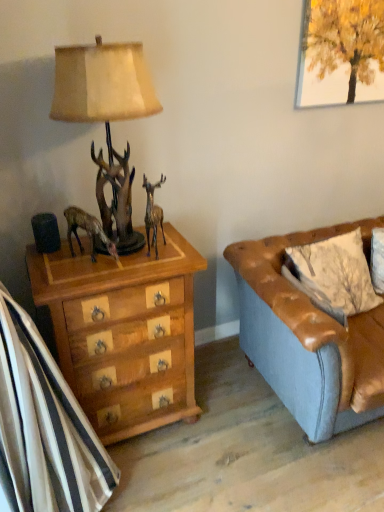
The image size is (384, 512). What do you see at coordinates (153, 214) in the screenshot? I see `metallic gold reindeer at center` at bounding box center [153, 214].

Where is `wooden chest of drawers at left`? wooden chest of drawers at left is located at coordinates (124, 332).

Based on the photo, looking at their sizes, would you say leather pillow at right is wider or thinner than metallic gold reindeer at center?

Result: In the image, leather pillow at right appears to be wider than metallic gold reindeer at center.

Could you tell me if leather pillow at right is facing metallic gold reindeer at center?

No, leather pillow at right is not facing towards metallic gold reindeer at center.

Is metallic gold reindeer at center surrounded by leather pillow at right?

No, metallic gold reindeer at center is located outside of leather pillow at right.

Measure the distance between leather pillow at right and metallic gold reindeer at center.

33.59 inches.

Is brown leather couch at right facing towards wooden chest of drawers at left?

No, brown leather couch at right is not aimed at wooden chest of drawers at left.

Between brown leather couch at right and wooden chest of drawers at left, which one appears on the right side from the viewer's perspective?

brown leather couch at right is more to the right.

Considering the positions of points (337, 420) and (98, 287), is point (337, 420) closer to camera compared to point (98, 287)?

No, it is behind (98, 287).

How different are the orientations of brown leather couch at right and wooden chest of drawers at left in degrees?

The angle between the facing direction of brown leather couch at right and the facing direction of wooden chest of drawers at left is 0.751 degrees.

From the image's perspective, which one is positioned higher, wooden chest of drawers at left or matte brown lamp at left?

matte brown lamp at left.

Is the surface of wooden chest of drawers at left in direct contact with matte brown lamp at left?

There is a gap between wooden chest of drawers at left and matte brown lamp at left.

Is wooden chest of drawers at left shorter than matte brown lamp at left?

No, wooden chest of drawers at left is not shorter than matte brown lamp at left.

Would you say matte brown lamp at left is part of wooden chest of drawers at left's contents?

That's incorrect, matte brown lamp at left is not inside wooden chest of drawers at left.

Is metallic gold reindeer at center directly adjacent to brown leather couch at right?

No, metallic gold reindeer at center is not in contact with brown leather couch at right.

Which is closer, (155, 234) or (321, 320)?

Positioned in front is point (321, 320).

What's the angular difference between metallic gold reindeer at center and brown leather couch at right's facing directions?

The angular difference between metallic gold reindeer at center and brown leather couch at right is 61.3 degrees.

In terms of size, does metallic gold reindeer at center appear bigger or smaller than leather pillow at right?

Considering their sizes, metallic gold reindeer at center takes up less space than leather pillow at right.

Between metallic gold reindeer at center and leather pillow at right, which one appears on the right side from the viewer's perspective?

leather pillow at right is more to the right.

Is metallic gold reindeer at center inside the boundaries of leather pillow at right, or outside?

metallic gold reindeer at center lies outside leather pillow at right.

Based on the photo, is antique brown statue at left facing away from leather pillow at right?

antique brown statue at left does not have its back to leather pillow at right.

Does point (97, 229) come closer to viewer compared to point (288, 261)?

That is True.

Consider the image. How different are the orientations of antique brown statue at left and leather pillow at right in degrees?

38.2 degrees.

From a real-world perspective, is antique brown statue at left located beneath leather pillow at right?

Incorrect, from a real-world perspective, antique brown statue at left is higher than leather pillow at right.

From a real-world perspective, relative to brown leather couch at right, is wooden chest of drawers at left vertically above or below?

wooden chest of drawers at left is above brown leather couch at right.

From the image's perspective, which object appears higher, wooden chest of drawers at left or brown leather couch at right?

brown leather couch at right, from the image's perspective.

Which object is more forward, wooden chest of drawers at left or brown leather couch at right?

brown leather couch at right is closer to the camera.

How many degrees apart are the facing directions of wooden chest of drawers at left and brown leather couch at right?

0.751 degrees.

You are a GUI agent. You are given a task and a screenshot of the screen. Output one action in this format:
    pyautogui.click(x=<x>, y=<y>)
    Task: Click on the reindeer above the leather pillow at right (from a real-world perspective)
    
    Given the screenshot: What is the action you would take?
    pyautogui.click(x=153, y=214)

This screenshot has height=512, width=384. What are the coordinates of `studio couch lying in front of the wooden chest of drawers at left` in the screenshot? It's located at (309, 338).

Looking at this image, looking at the image, which one is located further to leather pillow at right, metallic gold reindeer at center or brown leather couch at right?

metallic gold reindeer at center.

When comparing their distances from antique brown statue at left, does metallic gold reindeer at center or brown leather couch at right seem further?

brown leather couch at right is positioned further to the anchor antique brown statue at left.

Based on their spatial positions, is wooden chest of drawers at left or matte brown lamp at left further from metallic gold reindeer at center?

Based on the image, matte brown lamp at left appears to be further to metallic gold reindeer at center.

Estimate the real-world distances between objects in this image. Which object is further from matte brown lamp at left, antique brown statue at left or metallic gold reindeer at center?

antique brown statue at left is positioned further to the anchor matte brown lamp at left.

Looking at the image, which one is located closer to matte brown lamp at left, metallic gold reindeer at center or brown leather couch at right?

Among the two, metallic gold reindeer at center is located nearer to matte brown lamp at left.

Estimate the real-world distances between objects in this image. Which object is closer to matte brown lamp at left, brown leather couch at right or leather pillow at right?

brown leather couch at right is closer to matte brown lamp at left.

Estimate the real-world distances between objects in this image. Which object is closer to matte brown lamp at left, wooden chest of drawers at left or leather pillow at right?

wooden chest of drawers at left is positioned closer to the anchor matte brown lamp at left.

Estimate the real-world distances between objects in this image. Which object is further from brown leather couch at right, antique brown statue at left or metallic gold reindeer at center?

antique brown statue at left is further to brown leather couch at right.

Find the location of a particular element. This screenshot has height=512, width=384. lamp between antique brown statue at left and leather pillow at right from left to right is located at coordinates (102, 83).

The image size is (384, 512). Find the location of `reindeer situated between wooden chest of drawers at left and leather pillow at right from left to right`. reindeer situated between wooden chest of drawers at left and leather pillow at right from left to right is located at coordinates (153, 214).

Identify the location of reindeer between matte brown lamp at left and antique brown statue at left from front to back. The image size is (384, 512). (153, 214).

Locate an element on the screen. The height and width of the screenshot is (512, 384). reindeer situated between antique brown statue at left and brown leather couch at right from left to right is located at coordinates (153, 214).